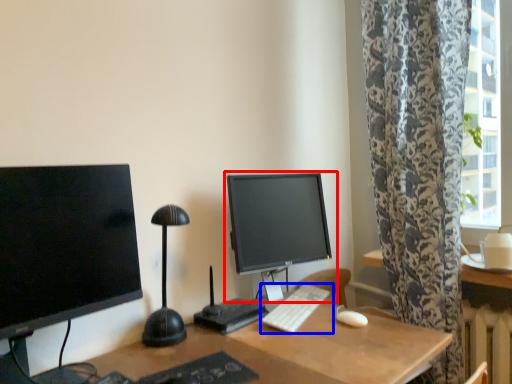
Question: Which of the following is the closest to the observer, computer monitor (highlighted by a red box) or computer keyboard (highlighted by a blue box)?

Choices:
 (A) computer monitor
 (B) computer keyboard

Answer: (B)